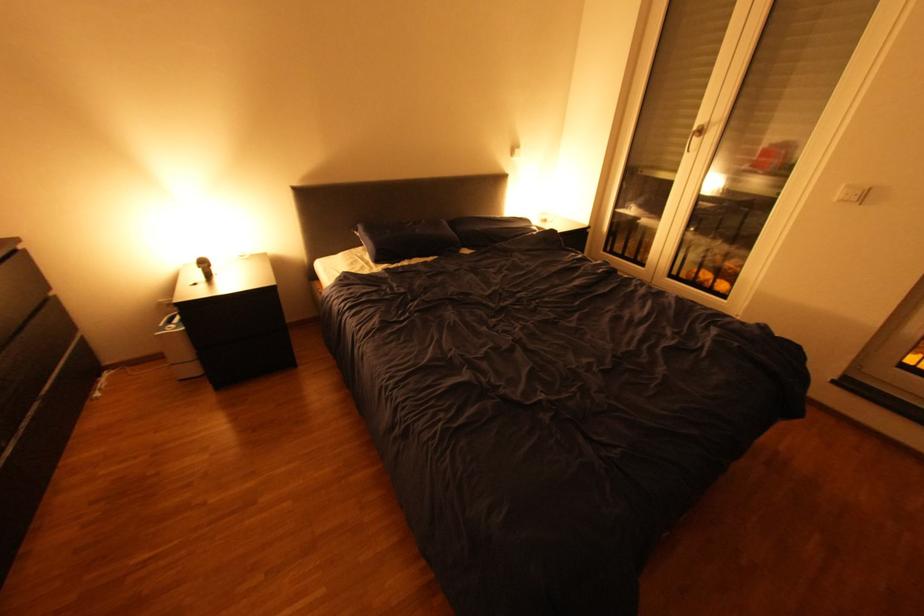
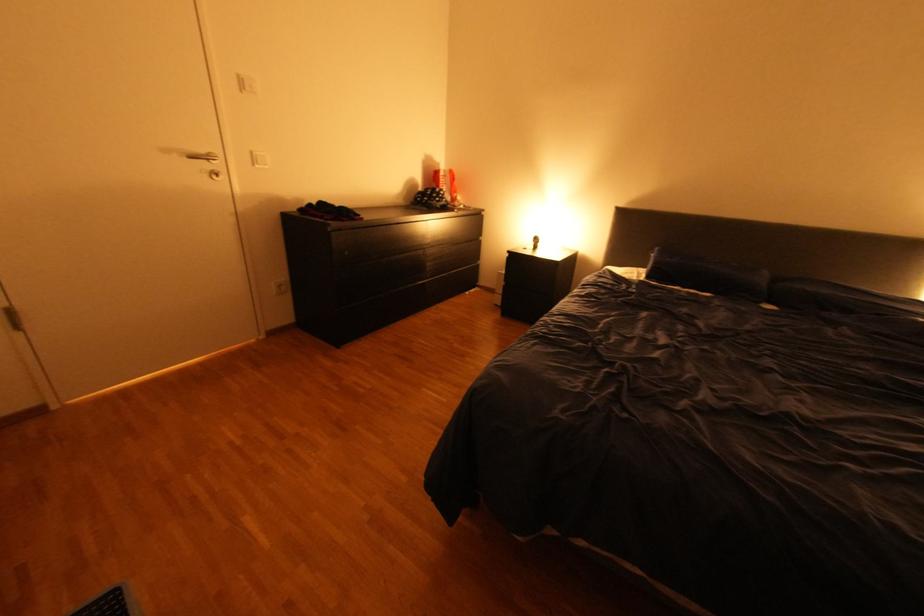
In the second image, find the point that corresponds to pixel 377 264 in the first image.

(648, 277)